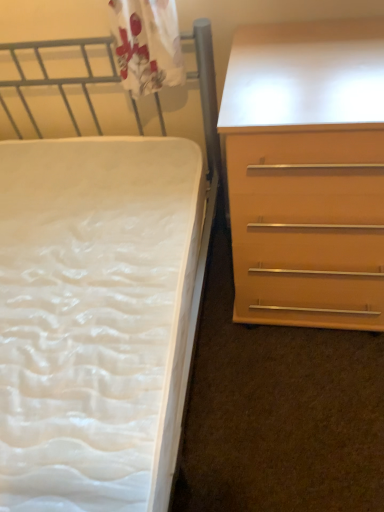
This screenshot has width=384, height=512. I want to click on white textured mattress at left, so click(x=97, y=317).

What is the approximate height of white textured mattress at left?

It is 34.21 inches.

What do you see at coordinates (97, 317) in the screenshot? The image size is (384, 512). I see `white textured mattress at left` at bounding box center [97, 317].

Measure the distance between white textured mattress at left and camera.

The depth of white textured mattress at left is 28.74 inches.

Locate an element on the screen. The image size is (384, 512). light brown wood chest of drawers at right is located at coordinates (307, 173).

The width and height of the screenshot is (384, 512). What do you see at coordinates (307, 173) in the screenshot?
I see `light brown wood chest of drawers at right` at bounding box center [307, 173].

Consider the image. What is the approximate height of light brown wood chest of drawers at right?

light brown wood chest of drawers at right is 31.71 inches in height.

The height and width of the screenshot is (512, 384). I want to click on white textured mattress at left, so click(97, 317).

Considering the relative positions of light brown wood chest of drawers at right and white textured mattress at left in the image provided, is light brown wood chest of drawers at right to the left of white textured mattress at left from the viewer's perspective?

In fact, light brown wood chest of drawers at right is to the right of white textured mattress at left.

Which is in front, light brown wood chest of drawers at right or white textured mattress at left?

white textured mattress at left is closer to the camera.

Is point (236, 257) positioned behind point (168, 352)?

Yes, point (236, 257) is farther from viewer.

From the image's perspective, is light brown wood chest of drawers at right on top of white textured mattress at left?

Yes, from the image's perspective, light brown wood chest of drawers at right is on top of white textured mattress at left.

From a real-world perspective, between light brown wood chest of drawers at right and white textured mattress at left, who is vertically higher?

In real-world perspective, white textured mattress at left is above.

Which of these two, light brown wood chest of drawers at right or white textured mattress at left, is wider?

With larger width is white textured mattress at left.

Who is taller, light brown wood chest of drawers at right or white textured mattress at left?

white textured mattress at left.

Considering the sizes of objects light brown wood chest of drawers at right and white textured mattress at left in the image provided, who is bigger, light brown wood chest of drawers at right or white textured mattress at left?

With larger size is white textured mattress at left.

Do you think light brown wood chest of drawers at right is within white textured mattress at left, or outside of it?

light brown wood chest of drawers at right is spatially situated outside white textured mattress at left.

Are light brown wood chest of drawers at right and white textured mattress at left located far from each other?

light brown wood chest of drawers at right is near white textured mattress at left, not far away.

Is light brown wood chest of drawers at right facing towards white textured mattress at left?

No, light brown wood chest of drawers at right is not facing towards white textured mattress at left.

How far apart are light brown wood chest of drawers at right and white textured mattress at left?

light brown wood chest of drawers at right and white textured mattress at left are 17.35 inches apart.

Where is `bed that appears above the light brown wood chest of drawers at right (from a real-world perspective)`? Image resolution: width=384 pixels, height=512 pixels. bed that appears above the light brown wood chest of drawers at right (from a real-world perspective) is located at coordinates (97, 317).

Is white textured mattress at left to the left of light brown wood chest of drawers at right from the viewer's perspective?

Correct, you'll find white textured mattress at left to the left of light brown wood chest of drawers at right.

Is the position of white textured mattress at left less distant than that of light brown wood chest of drawers at right?

Yes, white textured mattress at left is closer to the camera.

Does point (124, 182) appear closer or farther from the camera than point (256, 244)?

Point (124, 182) is farther from the camera than point (256, 244).

From the image's perspective, does white textured mattress at left appear lower than light brown wood chest of drawers at right?

Indeed, from the image's perspective, white textured mattress at left is shown beneath light brown wood chest of drawers at right.

Based on the photo, from a real-world perspective, is white textured mattress at left positioned under light brown wood chest of drawers at right based on gravity?

No, from a real-world perspective, white textured mattress at left is not beneath light brown wood chest of drawers at right.

Does white textured mattress at left have a greater width compared to light brown wood chest of drawers at right?

Indeed, white textured mattress at left has a greater width compared to light brown wood chest of drawers at right.

In terms of height, does white textured mattress at left look taller or shorter compared to light brown wood chest of drawers at right?

white textured mattress at left is taller than light brown wood chest of drawers at right.

Does white textured mattress at left have a smaller size compared to light brown wood chest of drawers at right?

No, white textured mattress at left is not smaller than light brown wood chest of drawers at right.

Is light brown wood chest of drawers at right located within white textured mattress at left?

No, light brown wood chest of drawers at right is not inside white textured mattress at left.

Is white textured mattress at left not close to light brown wood chest of drawers at right?

No, white textured mattress at left is in close proximity to light brown wood chest of drawers at right.

Could you tell me if white textured mattress at left is turned towards light brown wood chest of drawers at right?

No, white textured mattress at left is not facing towards light brown wood chest of drawers at right.

Locate an element on the screen. The height and width of the screenshot is (512, 384). chest of drawers below the white textured mattress at left (from a real-world perspective) is located at coordinates (307, 173).

Where is `bed located on the left of light brown wood chest of drawers at right`? Image resolution: width=384 pixels, height=512 pixels. bed located on the left of light brown wood chest of drawers at right is located at coordinates (97, 317).

Find the location of a particular element. The height and width of the screenshot is (512, 384). bed in front of the light brown wood chest of drawers at right is located at coordinates (97, 317).